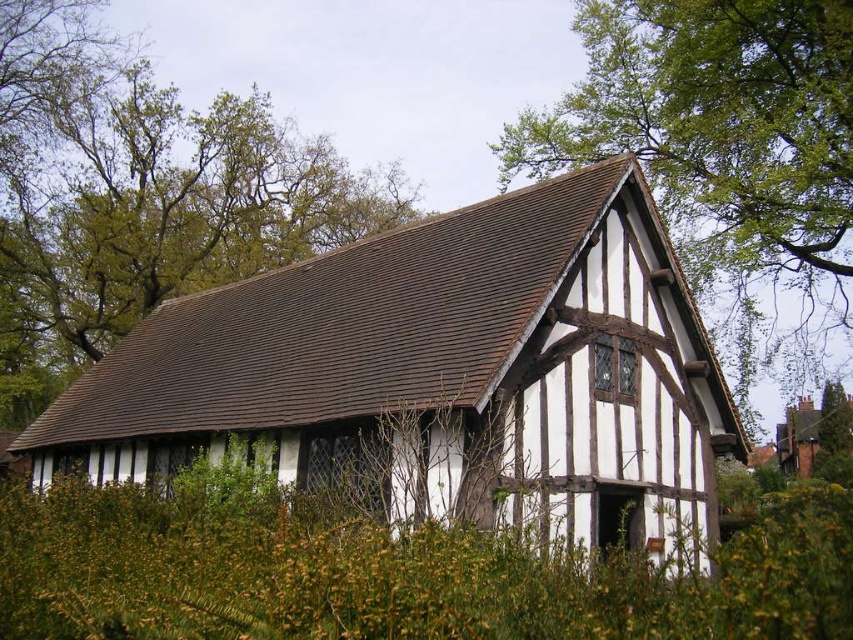
Question: Does green leafy tree at upper center have a lesser width compared to green leafy tree at upper right?

Choices:
 (A) no
 (B) yes

Answer: (B)

Question: Which point is closer to the camera?

Choices:
 (A) (64, 0)
 (B) (811, 371)

Answer: (A)

Question: Can you confirm if green leafy tree at upper center is positioned to the right of green leafy tree at upper right?

Choices:
 (A) yes
 (B) no

Answer: (B)

Question: Can you confirm if green leafy tree at upper center is positioned above green leafy tree at upper right?

Choices:
 (A) no
 (B) yes

Answer: (B)